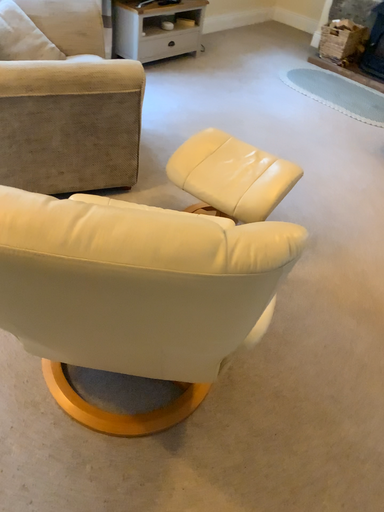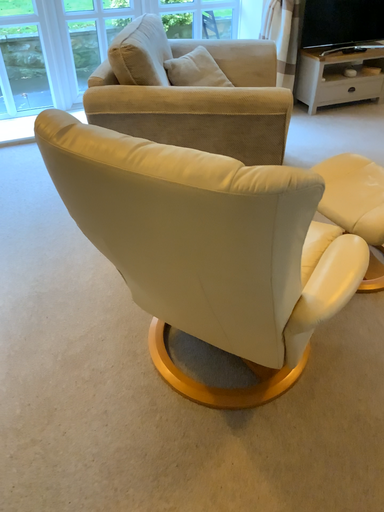
Question: How did the camera likely rotate when shooting the video?

Choices:
 (A) rotated left
 (B) rotated right

Answer: (A)